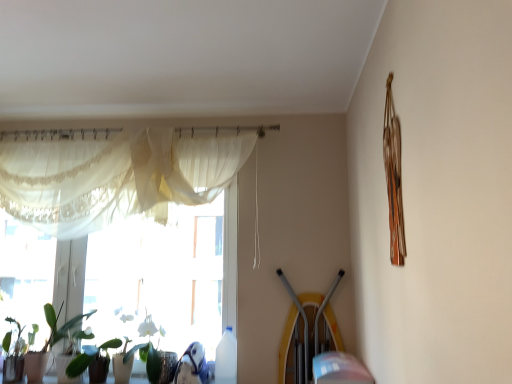
What is the approximate width of translucent fabric at left?

It is 6.37 inches.

This screenshot has height=384, width=512. Identify the location of green glossy plant at lower left. (53, 341).

Describe the element at coordinates (53, 341) in the screenshot. I see `green glossy plant at lower left` at that location.

Measure the distance between point (116, 141) and camera.

2.59 meters.

You are a GUI agent. You are given a task and a screenshot of the screen. Output one action in this format:
    pyautogui.click(x=<x>, y=<y>)
    Task: Click on the green matte plant at lower left
    Image resolution: width=512 pixels, height=384 pixels.
    Given the screenshot: What is the action you would take?
    pyautogui.click(x=88, y=358)

Is translucent fabric at left positioned far away from green matte plant at lower left?

Yes.

Can you tell me how much translucent fabric at left and green matte plant at lower left differ in facing direction?

There is a 0.788-degree angle between the facing directions of translucent fabric at left and green matte plant at lower left.

Which object is thinner, translucent fabric at left or green matte plant at lower left?

translucent fabric at left is thinner.

From the image's perspective, does translucent fabric at left appear lower than green matte plant at lower left?

No.

Considering the positions of points (159, 219) and (80, 332), is point (159, 219) farther from camera compared to point (80, 332)?

Yes.

Is translucent fabric at left turned away from green glossy plant at lower left?

That's right, translucent fabric at left is facing away from green glossy plant at lower left.

Is translucent fabric at left taller than green glossy plant at lower left?

Yes, translucent fabric at left is taller than green glossy plant at lower left.

Is green matte plant at lower left shorter than translucent fabric at left?

Correct, green matte plant at lower left is not as tall as translucent fabric at left.

From the picture: Considering the positions of objects green matte plant at lower left and translucent fabric at left in the image provided, who is more to the right, green matte plant at lower left or translucent fabric at left?

Positioned to the right is green matte plant at lower left.

Measure the distance between green matte plant at lower left and translucent fabric at left.

green matte plant at lower left and translucent fabric at left are 1.01 meters apart from each other.

From the image's perspective, is green matte plant at lower left above or below translucent fabric at left?

Based on their image positions, green matte plant at lower left is located beneath translucent fabric at left.

Does green matte plant at lower left have a lesser width compared to green glossy plant at lower left?

Correct, the width of green matte plant at lower left is less than that of green glossy plant at lower left.

Would you consider green matte plant at lower left to be distant from green glossy plant at lower left?

No, green matte plant at lower left is not far from green glossy plant at lower left.

Does green matte plant at lower left have a smaller size compared to green glossy plant at lower left?

Yes, green matte plant at lower left is smaller than green glossy plant at lower left.

Is green glossy plant at lower left at the back of green matte plant at lower left?

No.

From a real-world perspective, does green matte plant at lower left sit lower than sheer white curtain at upper left?

Yes, from a real-world perspective, green matte plant at lower left is beneath sheer white curtain at upper left.

Which object is closer to the camera taking this photo, green matte plant at lower left or sheer white curtain at upper left?

sheer white curtain at upper left is closer to the camera.

Is green matte plant at lower left looking in the opposite direction of sheer white curtain at upper left?

That's not correct — green matte plant at lower left is not looking away from sheer white curtain at upper left.

Looking at this image, is green glossy plant at lower left not within green matte plant at lower left?

Yes, green glossy plant at lower left is outside of green matte plant at lower left.

Is the position of green glossy plant at lower left more distant than that of green matte plant at lower left?

Yes, it is.

From a real-world perspective, is green glossy plant at lower left below green matte plant at lower left?

No, from a real-world perspective, green glossy plant at lower left is not beneath green matte plant at lower left.

Is green matte plant at lower left at the back of green glossy plant at lower left?

No, green matte plant at lower left is not at the back of green glossy plant at lower left.

Considering the sizes of green glossy plant at lower left and sheer white curtain at upper left in the image, is green glossy plant at lower left bigger or smaller than sheer white curtain at upper left?

In the image, green glossy plant at lower left appears to be smaller than sheer white curtain at upper left.

Is point (2, 344) in front of point (199, 201)?

Yes, it is.

Is green glossy plant at lower left behind sheer white curtain at upper left?

Yes, green glossy plant at lower left is further from the camera.

Is green glossy plant at lower left aimed at sheer white curtain at upper left?

No, green glossy plant at lower left is not facing towards sheer white curtain at upper left.

This screenshot has height=384, width=512. In the image, there is a translucent fabric at left. Find the location of `plant below it (from the image's perspective)`. plant below it (from the image's perspective) is located at coordinates (88, 358).

Locate an element on the screen. The width and height of the screenshot is (512, 384). window above the green glossy plant at lower left (from the image's perspective) is located at coordinates (115, 177).

From the image, which object appears to be farther from sheer white curtain at upper left, translucent fabric at left or green glossy plant at lower left?

green glossy plant at lower left is positioned further to the anchor sheer white curtain at upper left.

Considering their positions, is sheer white curtain at upper left positioned closer to translucent fabric at left than green matte plant at lower left?

Among the two, sheer white curtain at upper left is located nearer to translucent fabric at left.

When comparing their distances from translucent fabric at left, does green glossy plant at lower left or sheer white curtain at upper left seem further?

green glossy plant at lower left is further to translucent fabric at left.

Which object lies further to the anchor point sheer white curtain at upper left, green glossy plant at lower left or translucent fabric at left?

green glossy plant at lower left is positioned further to the anchor sheer white curtain at upper left.

Considering their positions, is translucent fabric at left positioned closer to green matte plant at lower left than green glossy plant at lower left?

Among the two, green glossy plant at lower left is located nearer to green matte plant at lower left.

Considering their positions, is green matte plant at lower left positioned further to sheer white curtain at upper left than green glossy plant at lower left?

green matte plant at lower left lies further to sheer white curtain at upper left than the other object.

Which object lies further to the anchor point green glossy plant at lower left, green matte plant at lower left or sheer white curtain at upper left?

sheer white curtain at upper left is further to green glossy plant at lower left.

Consider the image. When comparing their distances from green matte plant at lower left, does sheer white curtain at upper left or translucent fabric at left seem closer?

sheer white curtain at upper left is closer to green matte plant at lower left.

This screenshot has width=512, height=384. I want to click on houseplant between translucent fabric at left and green matte plant at lower left from top to bottom, so 53,341.

Where is `window that lies between sheer white curtain at upper left and green glossy plant at lower left from top to bottom`? The image size is (512, 384). window that lies between sheer white curtain at upper left and green glossy plant at lower left from top to bottom is located at coordinates (115, 177).

You are a GUI agent. You are given a task and a screenshot of the screen. Output one action in this format:
    pyautogui.click(x=<x>, y=<y>)
    Task: Click on the houseplant that lies between sheer white curtain at upper left and green matte plant at lower left from top to bottom
    This screenshot has height=384, width=512.
    Given the screenshot: What is the action you would take?
    pyautogui.click(x=53, y=341)

Where is `window between sheer white curtain at upper left and green matte plant at lower left in the vertical direction`? The width and height of the screenshot is (512, 384). window between sheer white curtain at upper left and green matte plant at lower left in the vertical direction is located at coordinates (115, 177).